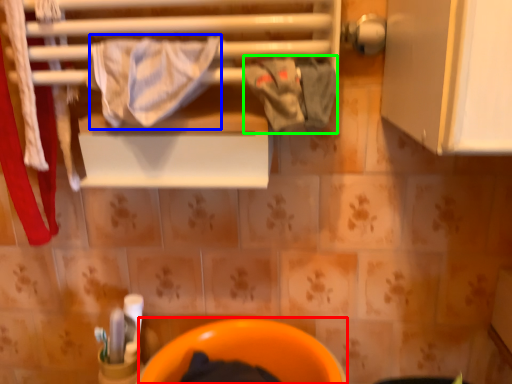
Question: Estimate the real-world distances between objects in this image. Which object is closer to toilet bowl (highlighted by a red box), bath towel (highlighted by a blue box) or clothing (highlighted by a green box)?

Choices:
 (A) bath towel
 (B) clothing

Answer: (B)